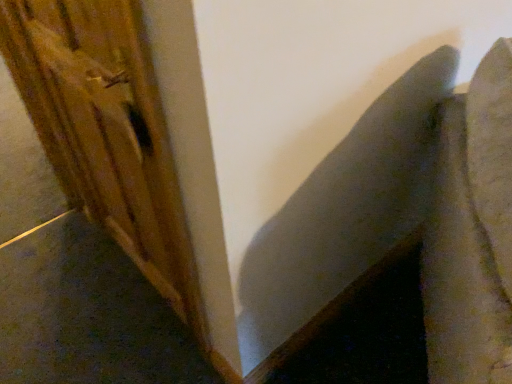
Question: Can you confirm if textured gray cushion at upper right is smaller than wooden plank at left?

Choices:
 (A) no
 (B) yes

Answer: (A)

Question: Is textured gray cushion at upper right oriented towards wooden plank at left?

Choices:
 (A) no
 (B) yes

Answer: (A)

Question: Considering the relative sizes of textured gray cushion at upper right and wooden plank at left in the image provided, is textured gray cushion at upper right taller than wooden plank at left?

Choices:
 (A) no
 (B) yes

Answer: (A)

Question: Are textured gray cushion at upper right and wooden plank at left located far from each other?

Choices:
 (A) no
 (B) yes

Answer: (A)

Question: Is textured gray cushion at upper right bigger than wooden plank at left?

Choices:
 (A) no
 (B) yes

Answer: (B)

Question: From a real-world perspective, is textured gray cushion at upper right positioned under wooden plank at left based on gravity?

Choices:
 (A) no
 (B) yes

Answer: (B)

Question: Can you confirm if wooden plank at left is shorter than textured gray cushion at upper right?

Choices:
 (A) yes
 (B) no

Answer: (B)

Question: Considering the relative positions of wooden plank at left and textured gray cushion at upper right in the image provided, is wooden plank at left to the left of textured gray cushion at upper right from the viewer's perspective?

Choices:
 (A) no
 (B) yes

Answer: (B)

Question: Can you confirm if wooden plank at left is smaller than textured gray cushion at upper right?

Choices:
 (A) no
 (B) yes

Answer: (B)

Question: Does wooden plank at left contain textured gray cushion at upper right?

Choices:
 (A) no
 (B) yes

Answer: (A)

Question: From the image's perspective, is wooden plank at left below textured gray cushion at upper right?

Choices:
 (A) yes
 (B) no

Answer: (B)

Question: Considering the relative positions of wooden plank at left and textured gray cushion at upper right in the image provided, is wooden plank at left to the right of textured gray cushion at upper right from the viewer's perspective?

Choices:
 (A) yes
 (B) no

Answer: (B)

Question: Considering their positions, is textured gray cushion at upper right located in front of or behind wooden plank at left?

Choices:
 (A) front
 (B) behind

Answer: (A)